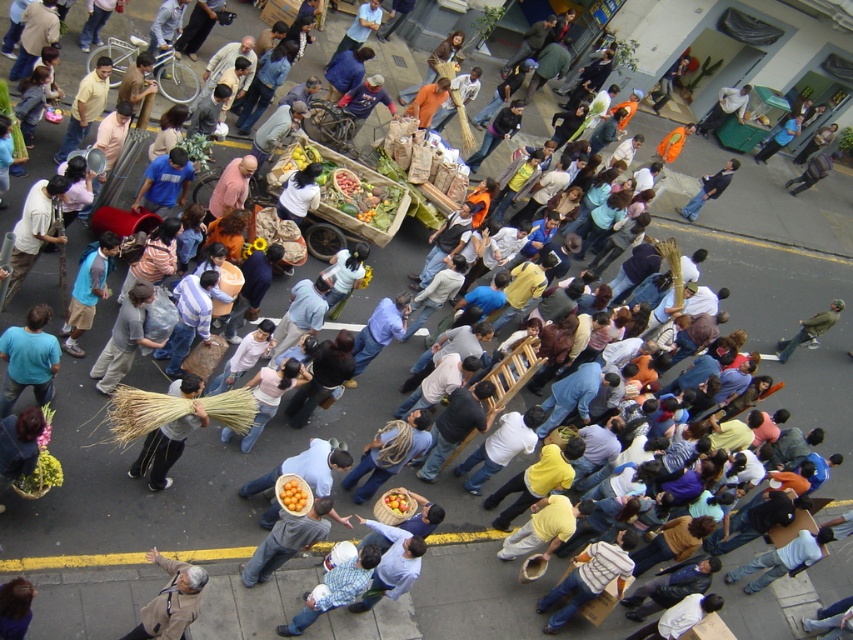
Question: Estimate the real-world distances between objects in this image. Which object is closer to the light brown leather jacket at lower left?

Choices:
 (A) dark blue shirt at upper right
 (B) striped cotton shirt at lower center
 (C) yellow matte oranges at center

Answer: (C)

Question: Does brown straw broom at center have a smaller size compared to dark blue shirt at upper right?

Choices:
 (A) yes
 (B) no

Answer: (A)

Question: Which of the following is the closest to the observer?

Choices:
 (A) (135, 342)
 (B) (345, 582)
 (C) (286, 493)

Answer: (B)

Question: Does blue t-shirt at center have a smaller size compared to yellow matte oranges at center?

Choices:
 (A) no
 (B) yes

Answer: (A)

Question: Which object is positioned closest to the blue t-shirt at lower left?

Choices:
 (A) light brown leather jacket at lower left
 (B) blue t-shirt at center
 (C) striped cotton shirt at lower center
 (D) gray cotton shirt at center

Answer: (D)

Question: Where is green fabric jacket at center located in relation to yellow matte oranges at center in the image?

Choices:
 (A) above
 (B) below

Answer: (A)